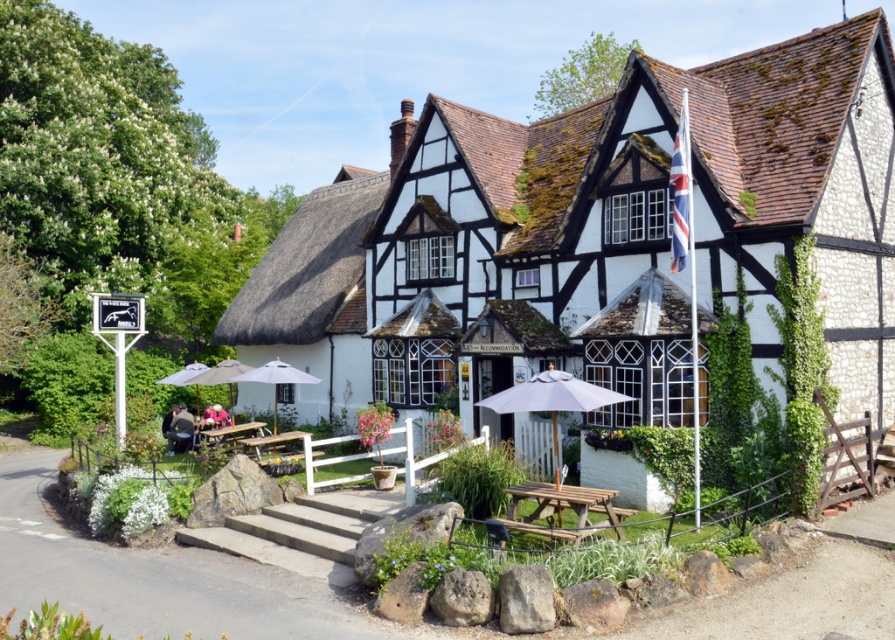
Is point (765, 200) positioned before point (589, 528)?

No.

Which is more to the left, white stone cottage at center or wooden picnic table at lower center?

white stone cottage at center is more to the left.

Where is `white stone cottage at center`? This screenshot has width=895, height=640. white stone cottage at center is located at coordinates (592, 237).

Where is `wooden picnic table at lower left`? The image size is (895, 640). wooden picnic table at lower left is located at coordinates (229, 429).

Can you confirm if wooden picnic table at lower left is wider than white fabric umbrella at lower left?

No, wooden picnic table at lower left is not wider than white fabric umbrella at lower left.

I want to click on wooden picnic table at lower left, so click(x=229, y=429).

Is white stone cottage at center to the left of white fabric umbrella at lower left from the viewer's perspective?

No, white stone cottage at center is not to the left of white fabric umbrella at lower left.

In the scene shown: Is the position of white stone cottage at center less distant than that of white fabric umbrella at lower left?

Yes, white stone cottage at center is closer to the viewer.

Who is more forward, (x=448, y=186) or (x=173, y=376)?

Point (x=448, y=186) is more forward.

The width and height of the screenshot is (895, 640). In order to click on white stone cottage at center in this screenshot , I will do `click(592, 237)`.